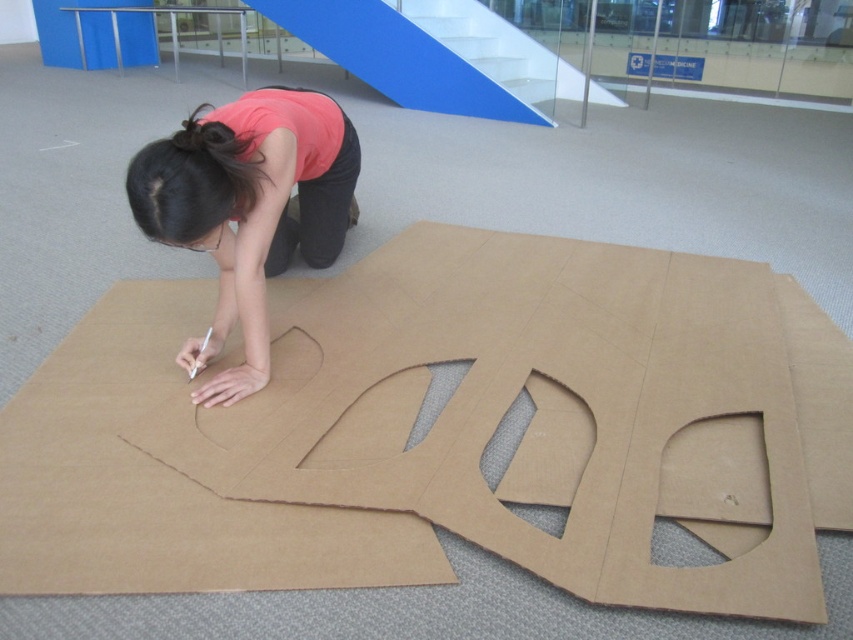
Does brown cardboard at center have a lesser width compared to black hair at upper center?

In fact, brown cardboard at center might be wider than black hair at upper center.

Which of these two, brown cardboard at center or black hair at upper center, stands shorter?

black hair at upper center

Who is more distant from viewer, [235,356] or [254,198]?

Positioned behind is point [235,356].

This screenshot has width=853, height=640. I want to click on brown cardboard at center, so click(x=438, y=429).

Can you confirm if pink matte shirt at center is bigger than black hair at upper center?

Indeed, pink matte shirt at center has a larger size compared to black hair at upper center.

Between pink matte shirt at center and black hair at upper center, which one has more height?

pink matte shirt at center is taller.

Is point (242, 116) positioned before point (230, 140)?

No, it is not.

The width and height of the screenshot is (853, 640). I want to click on pink matte shirt at center, so click(248, 208).

Can you confirm if brown cardboard at center is thinner than pink matte shirt at center?

No.

What do you see at coordinates (438, 429) in the screenshot? This screenshot has height=640, width=853. I see `brown cardboard at center` at bounding box center [438, 429].

Locate an element on the screen. brown cardboard at center is located at coordinates (438, 429).